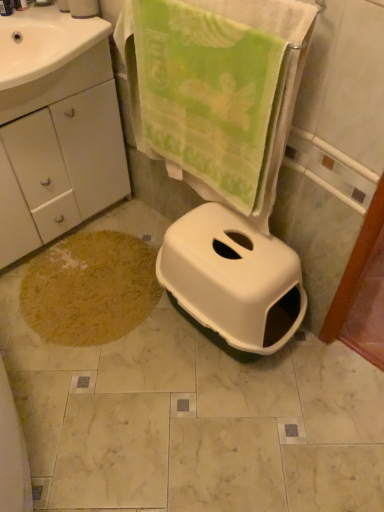
Question: Can you confirm if yellow textured bath mat at lower left is shorter than white plastic toilet at center?

Choices:
 (A) no
 (B) yes

Answer: (B)

Question: Is yellow textured bath mat at lower left oriented away from white plastic toilet at center?

Choices:
 (A) yes
 (B) no

Answer: (B)

Question: Can you confirm if yellow textured bath mat at lower left is positioned to the right of white plastic toilet at center?

Choices:
 (A) yes
 (B) no

Answer: (B)

Question: Is the position of yellow textured bath mat at lower left more distant than that of white plastic toilet at center?

Choices:
 (A) no
 (B) yes

Answer: (B)

Question: Can you confirm if yellow textured bath mat at lower left is wider than white plastic toilet at center?

Choices:
 (A) no
 (B) yes

Answer: (B)

Question: Based on their sizes in the image, would you say white matte cabinet at lower left is bigger or smaller than yellow textured bath mat at lower left?

Choices:
 (A) small
 (B) big

Answer: (B)

Question: From a real-world perspective, is white matte cabinet at lower left above or below yellow textured bath mat at lower left?

Choices:
 (A) below
 (B) above

Answer: (B)

Question: Considering their positions, is white matte cabinet at lower left located in front of or behind yellow textured bath mat at lower left?

Choices:
 (A) front
 (B) behind

Answer: (A)

Question: From the image's perspective, relative to yellow textured bath mat at lower left, is white matte cabinet at lower left above or below?

Choices:
 (A) below
 (B) above

Answer: (B)

Question: In terms of size, does white matte toilet paper at upper left appear bigger or smaller than green soft towel at upper center?

Choices:
 (A) big
 (B) small

Answer: (B)

Question: Would you say white matte toilet paper at upper left is inside or outside green soft towel at upper center?

Choices:
 (A) outside
 (B) inside

Answer: (A)

Question: From the image's perspective, is white matte toilet paper at upper left above or below green soft towel at upper center?

Choices:
 (A) below
 (B) above

Answer: (B)

Question: Considering the positions of white matte toilet paper at upper left and green soft towel at upper center in the image, is white matte toilet paper at upper left taller or shorter than green soft towel at upper center?

Choices:
 (A) short
 (B) tall

Answer: (A)

Question: Is yellow textured bath mat at lower left wider or thinner than white glossy sink at upper left?

Choices:
 (A) wide
 (B) thin

Answer: (A)

Question: Considering the positions of point (77, 342) and point (43, 99), is point (77, 342) closer or farther from the camera than point (43, 99)?

Choices:
 (A) closer
 (B) farther

Answer: (B)